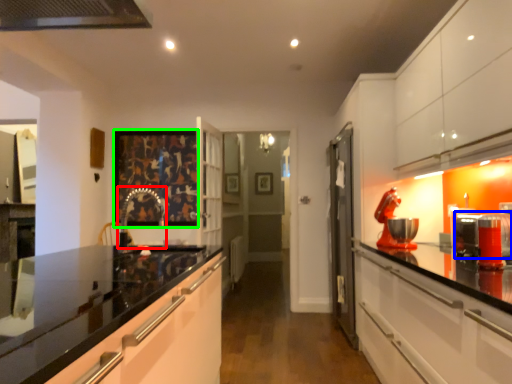
Question: Which is nearer to the faucet (highlighted by a red box)? appliance (highlighted by a blue box) or picture frame (highlighted by a green box).

Choices:
 (A) appliance
 (B) picture frame

Answer: (B)